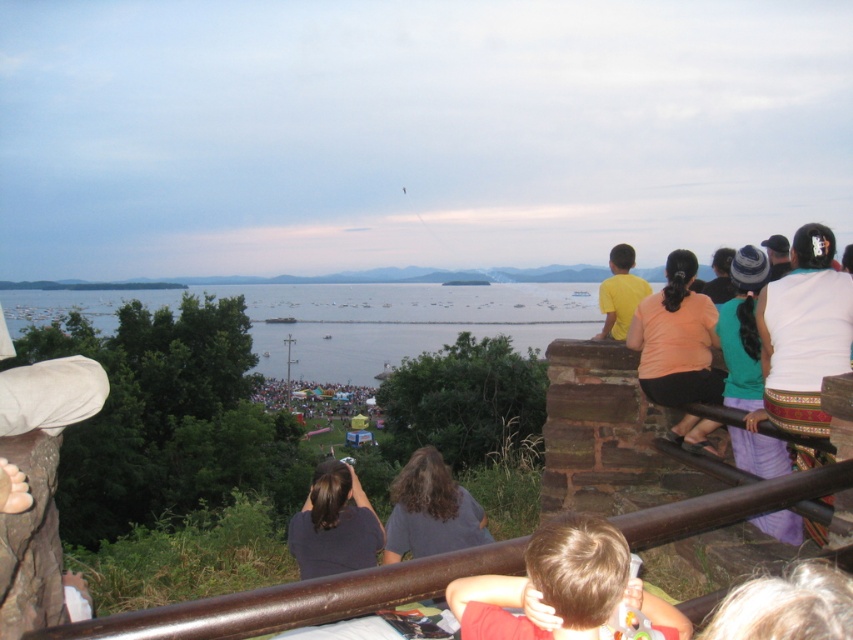
Question: Which of the following is the farthest from the observer?

Choices:
 (A) (553, 557)
 (B) (641, 371)
 (C) (846, 332)

Answer: (B)

Question: Is blonde hair at lower right wider than gray fabric shirt at center?

Choices:
 (A) yes
 (B) no

Answer: (B)

Question: Which of the following is the farthest from the observer?

Choices:
 (A) (640, 276)
 (B) (361, 528)
 (C) (498, 577)
 (D) (814, 305)

Answer: (A)

Question: Is orange matte shirt at center to the left of blonde hair at lower right from the viewer's perspective?

Choices:
 (A) yes
 (B) no

Answer: (B)

Question: Is orange matte shirt at center wider than blonde hair at lower right?

Choices:
 (A) no
 (B) yes

Answer: (A)

Question: Which point appears closest to the camera in this image?

Choices:
 (A) (437, 545)
 (B) (793, 401)

Answer: (B)